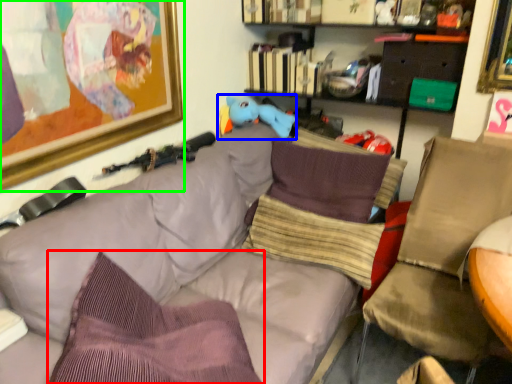
Question: Which object is positioned closest to pillow (highlighted by a red box)? Select from toy (highlighted by a blue box) and picture frame (highlighted by a green box).

Choices:
 (A) toy
 (B) picture frame

Answer: (B)